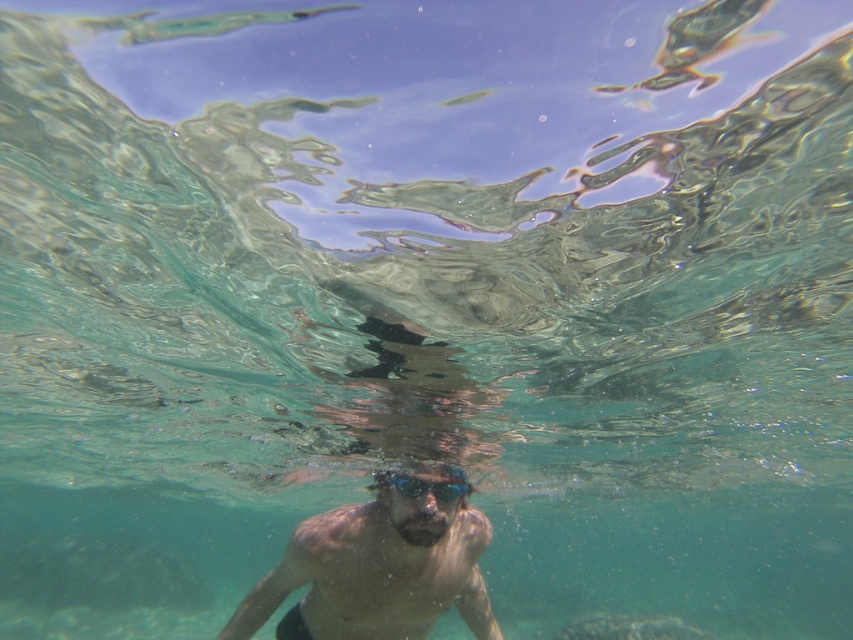
You are a lifeguard observing the underwater scene. You notice a point marked at coordinates (379, 566). What does this point indicate?

The point at (379, 566) marks the smooth skin man at center.

You are a lifeguard observing the underwater scene. The smooth skin man at center and the transparent plastic goggles at center are in your view. Which object is closer to the water surface?

The transparent plastic goggles at center are closer to the water surface because the smooth skin man at center is below them.